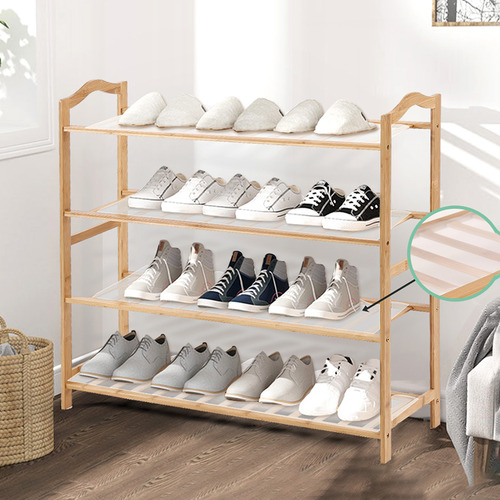
Where is `shoes on top shelf`? The image size is (500, 500). shoes on top shelf is located at coordinates (147, 108), (179, 113), (219, 110), (256, 113), (295, 113), (337, 118).